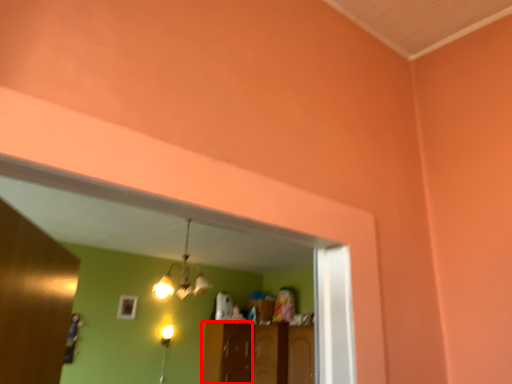
Question: From the image's perspective, where is cabinetry (annotated by the red box) located in relation to light fixture in the image?

Choices:
 (A) below
 (B) above

Answer: (A)